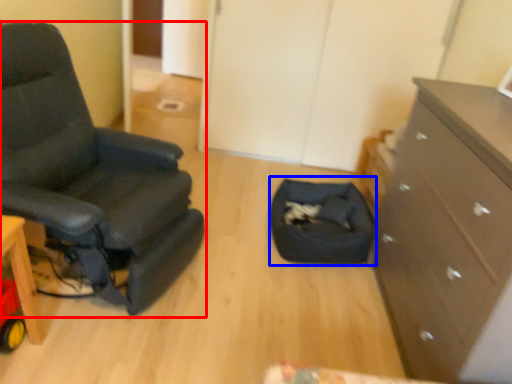
Question: Which of the following is the closest to the observer, chair (highlighted by a red box) or footrest (highlighted by a blue box)?

Choices:
 (A) chair
 (B) footrest

Answer: (A)